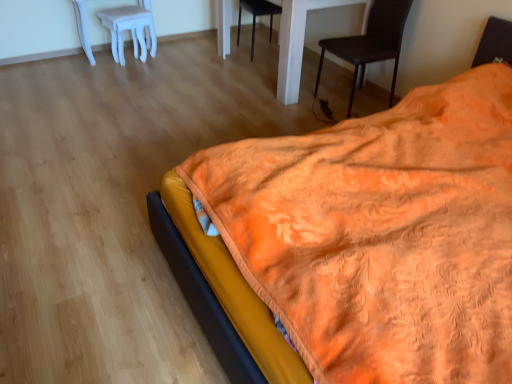
Where is `vacant area located to the right-hand side of white plastic stool at upper left`? vacant area located to the right-hand side of white plastic stool at upper left is located at coordinates (166, 62).